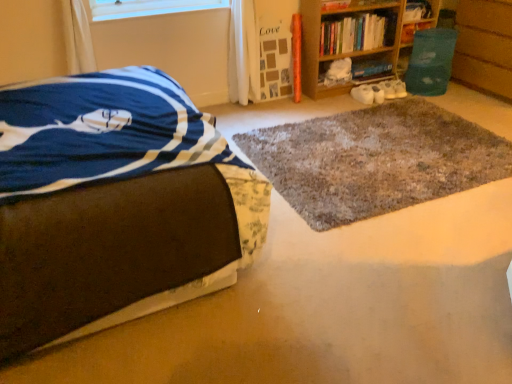
Locate an element on the screen. Image resolution: width=512 pixels, height=384 pixels. blank space situated above transparent plastic window screen at upper center (from a real-world perspective) is located at coordinates (161, 9).